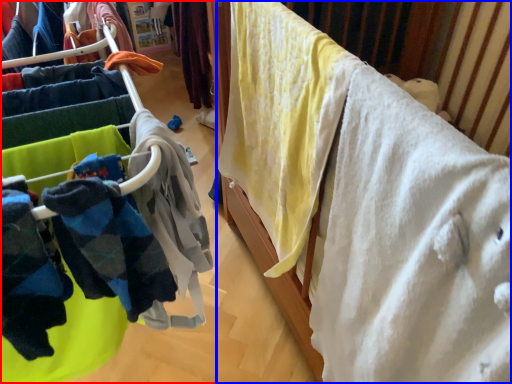
Question: Among these objects, which one is farthest to the camera, closet (highlighted by a red box) or furniture (highlighted by a blue box)?

Choices:
 (A) closet
 (B) furniture

Answer: (B)